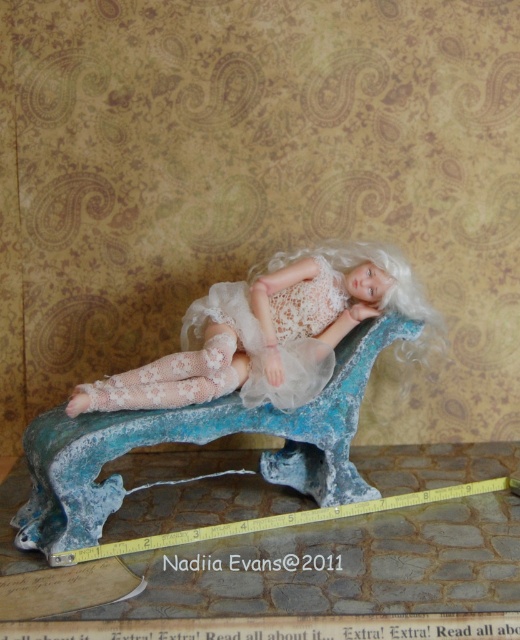
You are setting up a miniature display and want to ensure the white lace dress at center is visible. Is the yellow rubber tape measure at lower center blocking its view from above?

The white lace dress at center is positioned over the yellow rubber tape measure at lower center, so the tape measure is underneath the dress and not blocking its view from above.

You are a miniature designer who needs to place a new accessory at the point marked by the yellow measuring tape at coordinates point [360,301]. Considering the scene, how far will this accessory be from the camera?

The point [360,301] is 4.26 feet away from the camera, so the accessory placed there will be 4.26 feet away from the camera.